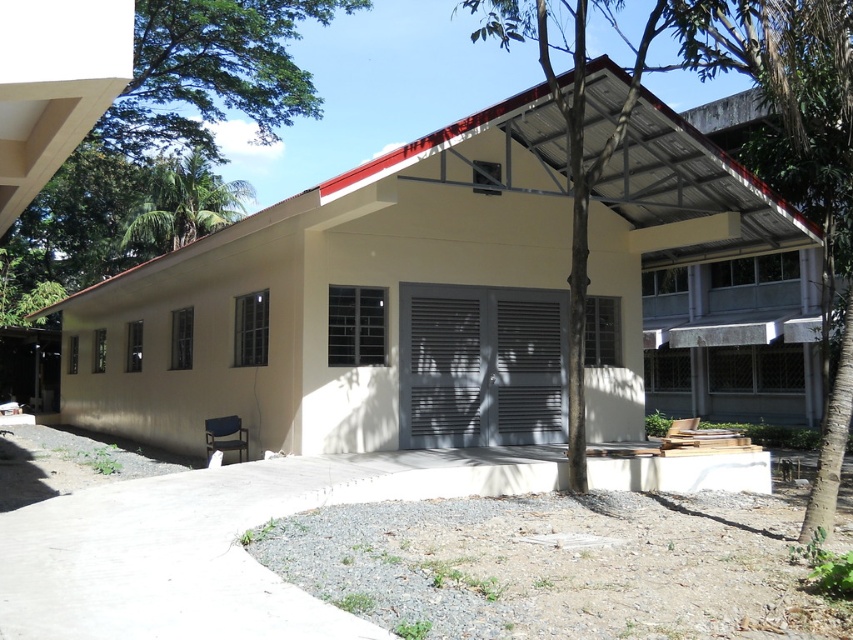
Which is above, green leafy tree at center or green leafy tree at upper left?

green leafy tree at center is higher up.

Between point (802, 74) and point (189, 202), which one is positioned behind?

The point (189, 202) is more distant.

The height and width of the screenshot is (640, 853). In order to click on green leafy tree at center in this screenshot , I will do `click(700, 77)`.

Image resolution: width=853 pixels, height=640 pixels. I want to click on green leafy tree at center, so click(x=700, y=77).